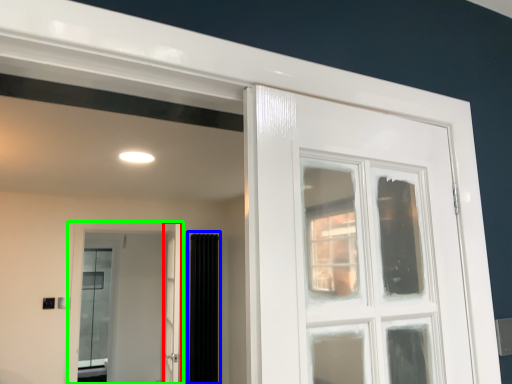
Question: Considering the real-world distances, which object is farthest from screen door (highlighted by a red box)? curtain (highlighted by a blue box) or door (highlighted by a green box)?

Choices:
 (A) curtain
 (B) door

Answer: (B)